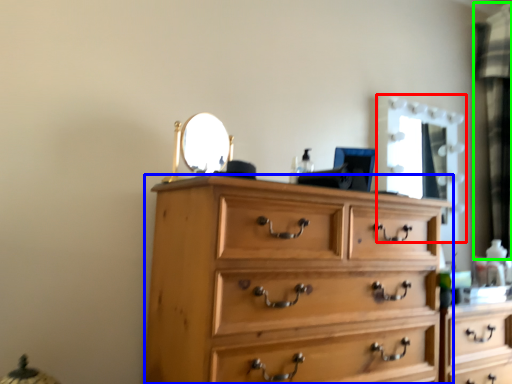
Question: Which object is the closest to the mirror (highlighted by a red box)? Choose among these: chest of drawers (highlighted by a blue box) or curtain (highlighted by a green box).

Choices:
 (A) chest of drawers
 (B) curtain

Answer: (B)